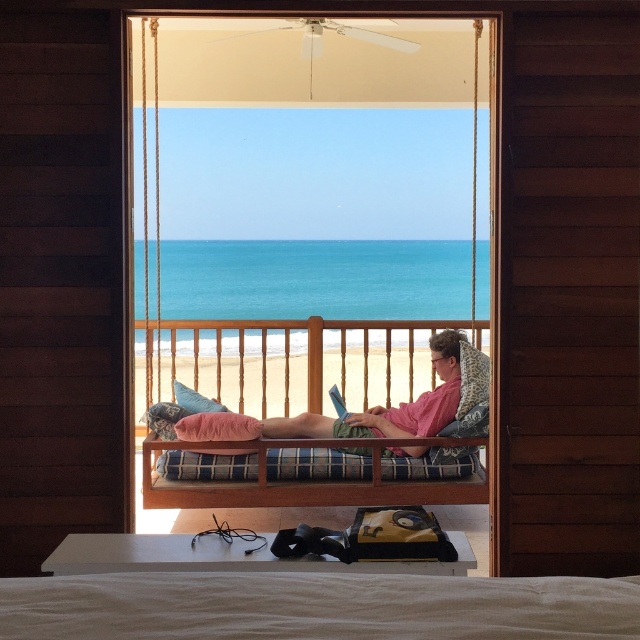
You are standing in the wooden structure and want to reach the plaid fabric bed at center. The bed is 6.40 meters away. If you take 2 steps of 0.8 meters each, how many more meters do you need to walk to reach the bed?

After taking 2 steps of 0.8 meters each, you have covered 1.6 meters. The plaid fabric bed at center is 6.40 meters away, so you need to walk an additional 4.8 meters to reach it.

Looking at this image, you are planning to sleep on the plaid fabric bed at center. However, there is a wooden cushioned swing at center above it. Will the swing interfere with your ability to lie down comfortably on the bed?

The wooden cushioned swing at center is positioned over the plaid fabric bed at center, so it may block access or space needed to lie down comfortably on the bed.

You are a guest staying in the wooden structure and want to place a teal fabric pillow at center on the wooden cushioned swing at center. Can the pillow fit vertically on the swing?

The wooden cushioned swing at center is taller than the teal fabric pillow at center, so the pillow can fit vertically on the swing.